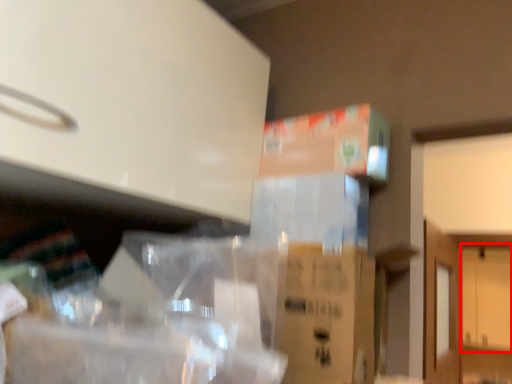
Question: From the image's perspective, what is the correct spatial relationship of door (annotated by the red box) in relation to cardboard box?

Choices:
 (A) above
 (B) below

Answer: (B)